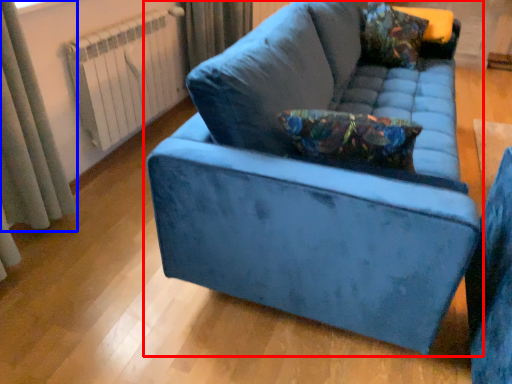
Question: Which object is closer to the camera taking this photo, studio couch (highlighted by a red box) or curtain (highlighted by a blue box)?

Choices:
 (A) studio couch
 (B) curtain

Answer: (A)